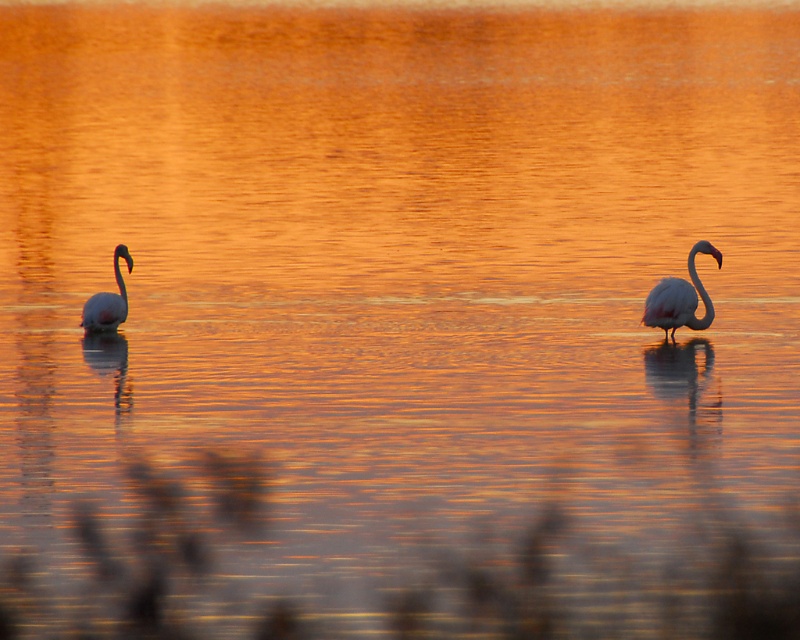
You are a photographer trying to capture the two swans in the scene. The pink matte swan at right and the pink feathered swan at left are both in the frame. Which swan should you focus on if you want to highlight the larger one in your photo?

The pink feathered swan at left is larger, so focusing on it will highlight the larger one in your photo.

You are a photographer trying to capture the two swans in the scene. You notice that the pink matte swan at right and the pink feathered swan at left are positioned in a specific way. Which swan is located to the right of the other?

The pink matte swan at right is positioned on the right side of the pink feathered swan at left.

You are a photographer taking a picture of the pink matte swan at right and the pink feathered swan at left. Which swan is positioned higher in the frame?

The pink matte swan at right is positioned higher in the frame than the pink feathered swan at left.